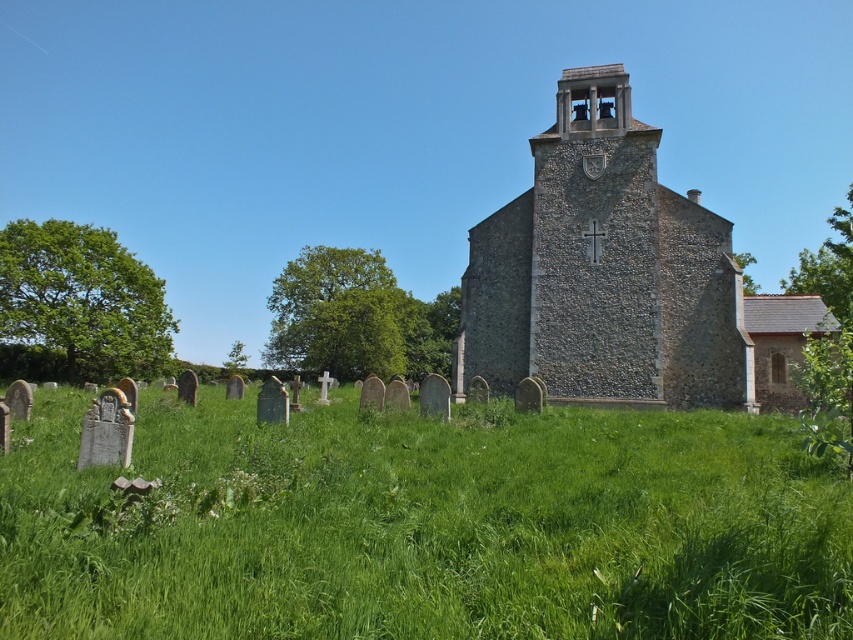
Question: Is green grassy field at lower center in front of stone church at center?

Choices:
 (A) no
 (B) yes

Answer: (B)

Question: Which of the following is the farthest from the observer?

Choices:
 (A) stone church at center
 (B) green grassy field at lower center

Answer: (A)

Question: Which point is closer to the camera?

Choices:
 (A) green grassy field at lower center
 (B) stone church at center

Answer: (A)

Question: Does green grassy field at lower center have a smaller size compared to stone church at center?

Choices:
 (A) yes
 (B) no

Answer: (A)

Question: Can you confirm if green grassy field at lower center is bigger than stone church at center?

Choices:
 (A) yes
 (B) no

Answer: (B)